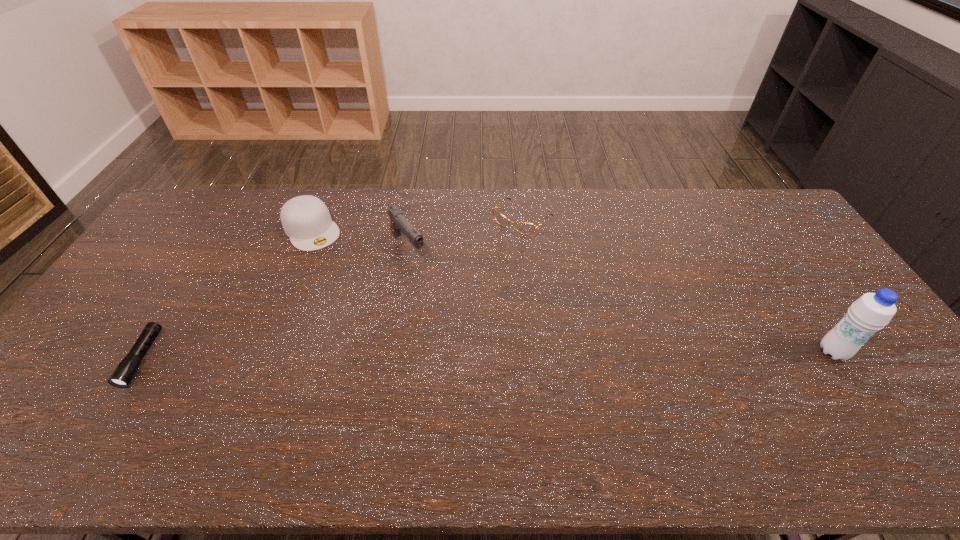
This screenshot has width=960, height=540. Identify the location of free space on the desktop that is between the leftmost object and the water bottle and is positioned on the front-facing side of the second object from right to left. (395, 356).

Locate an element on the screen. The width and height of the screenshot is (960, 540). vacant space on the desktop that is between the leftmost object and the rightmost object and is positioned in the direction the fourth shortest object is aimed is located at coordinates (498, 355).

This screenshot has width=960, height=540. In order to click on vacant spot on the desktop that is between the flashlight and the water bottle and is positioned on the front-facing side of the cap in this screenshot , I will do `click(400, 356)`.